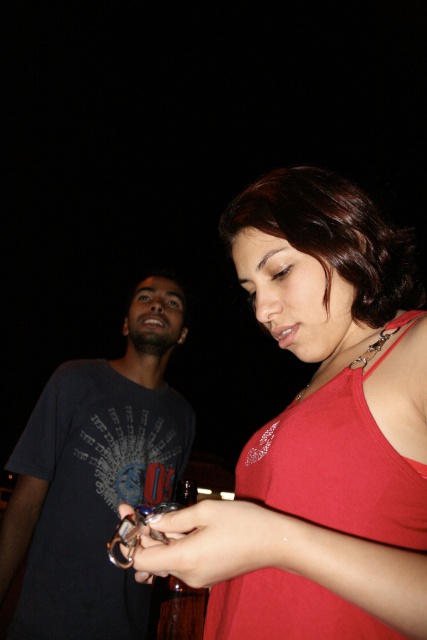
Is red matte tank top at center positioned in front of metallic shiny keychain at center?

No, it is not.

From the picture: Does red matte tank top at center have a lesser height compared to metallic shiny keychain at center?

No, red matte tank top at center is not shorter than metallic shiny keychain at center.

Is point (339, 436) closer to camera compared to point (260, 515)?

No, (339, 436) is further to viewer.

I want to click on red matte tank top at center, so click(338, 464).

The height and width of the screenshot is (640, 427). What do you see at coordinates (96, 476) in the screenshot? I see `dark blue t-shirt at left` at bounding box center [96, 476].

Is dark blue t-shirt at left bigger than metallic shiny keychain at center?

Correct, dark blue t-shirt at left is larger in size than metallic shiny keychain at center.

Who is more distant from viewer, (26, 490) or (152, 525)?

The point (26, 490) is behind.

At what (x,y) coordinates should I click in order to perform the action: click on dark blue t-shirt at left. Please return your answer as a coordinate pair (x, y). The image size is (427, 640). Looking at the image, I should click on (96, 476).

Is dark blue t-shirt at left thinner than red matte tank top at center?

In fact, dark blue t-shirt at left might be wider than red matte tank top at center.

Is point (75, 552) behind point (321, 442)?

Yes, point (75, 552) is behind point (321, 442).

Image resolution: width=427 pixels, height=640 pixels. Describe the element at coordinates (96, 476) in the screenshot. I see `dark blue t-shirt at left` at that location.

Where is `dark blue t-shirt at left`? The height and width of the screenshot is (640, 427). dark blue t-shirt at left is located at coordinates (96, 476).